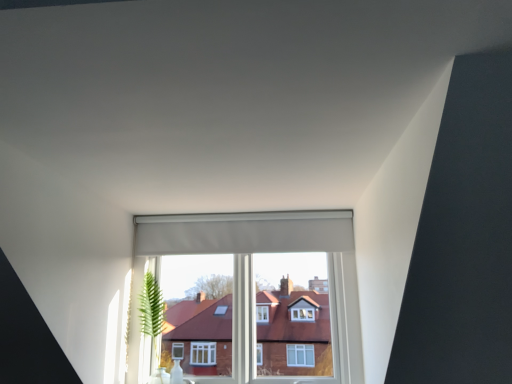
Describe the element at coordinates (244, 232) in the screenshot. I see `white matte curtain at upper center` at that location.

Identify the location of white matte curtain at upper center. (244, 232).

From the picture: In order to face white matte curtain at upper center, should I rotate leftwards or rightwards?

Rotate left and turn 1.937 degrees.

I want to click on white matte curtain at upper center, so click(x=244, y=232).